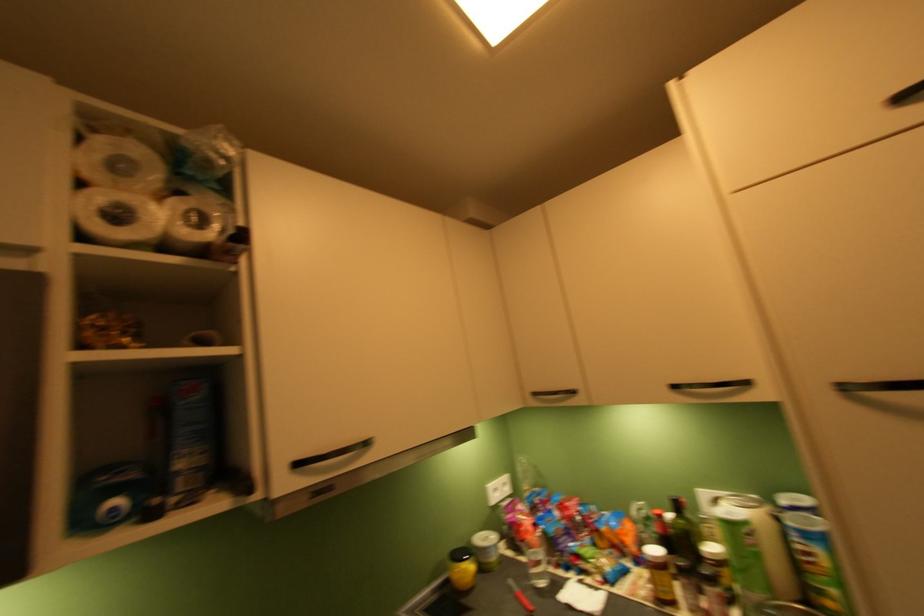
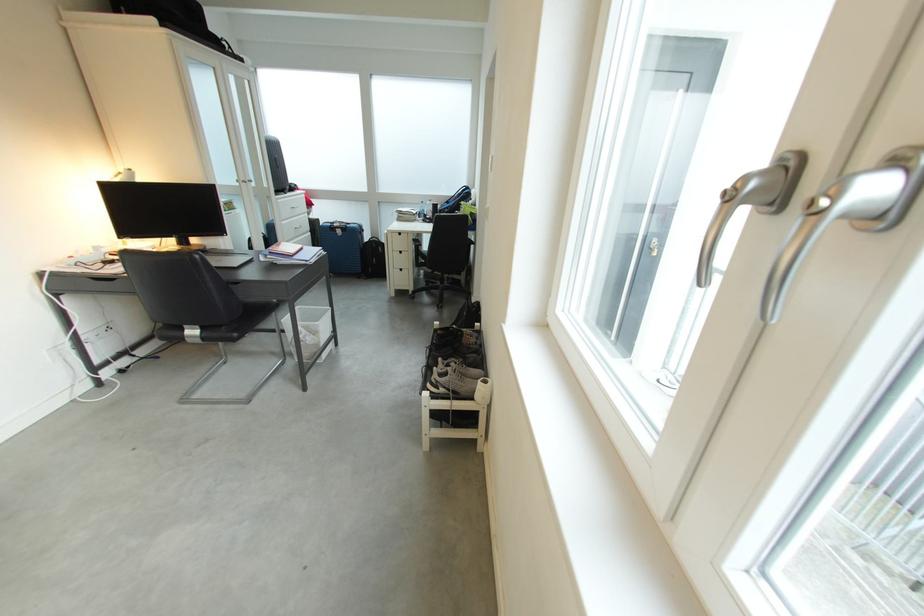
Question: I am providing you with two images of the same scene from different viewpoints. Which of the following objects are not visible in image2?

Choices:
 (A) white cup
 (B) silver window handle
 (C) white paper roll
 (D) blue suitcase

Answer: (C)